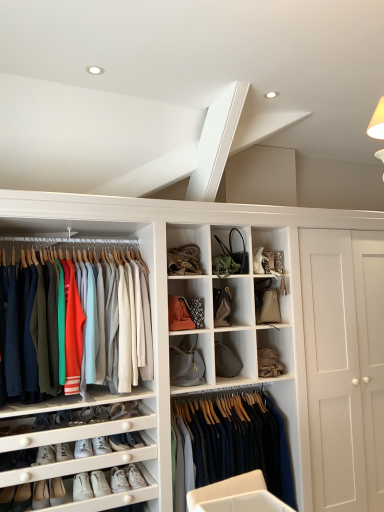
Question: In the image, is white leather shoe at lower left, placed as the first shoe when sorted from right to left, positioned in front of or behind knit sweater at left, which is the second clothing in right-to-left order?

Choices:
 (A) front
 (B) behind

Answer: (B)

Question: In terms of width, does white leather shoe at lower left, positioned as the second shoe in left-to-right order, look wider or thinner when compared to knit sweater at left, the 1th clothing from the top?

Choices:
 (A) wide
 (B) thin

Answer: (B)

Question: Which object is the closest to the white leather sneakers at lower left, the 2th footwear in the left-to-right sequence?

Choices:
 (A) white leather sneakers at lower left, the first footwear positioned from the right
 (B) white leather shoe at lower left, marked as the second shoe in a top-to-bottom arrangement
 (C) white leather sneakers at lower left, which is the 4th footwear in right-to-left order
 (D) matte black handbag at upper center, which appears as the 2th accessory when ordered from the bottom
 (E) dark blue wool sweater at center, the 1th clothing when ordered from bottom to top

Answer: (C)

Question: Which is farther from the matte black handbag at upper center, which is the 2th accessory from left to right?

Choices:
 (A) matte brown leather handbag at center, the 4th cabinet positioned from the bottom
 (B) white leather sneakers at lower left, which ranks as the 6th footwear in right-to-left order
 (C) knit sweater at left, the first clothing from the left
 (D) white leather shoe at lower left, which appears as the 1th shoe when viewed from the left
 (E) white leather sneakers at lower left, positioned as the sixth footwear in left-to-right order

Answer: (D)